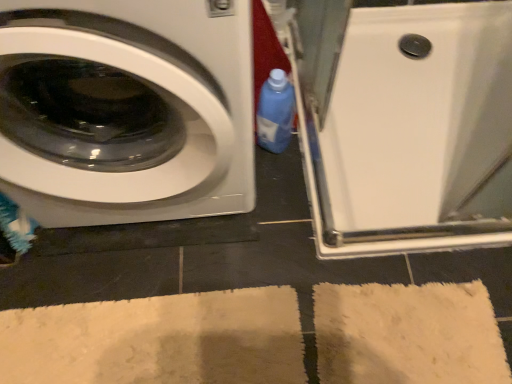
The height and width of the screenshot is (384, 512). Describe the element at coordinates (275, 112) in the screenshot. I see `blue plastic bottle at center` at that location.

Measure the distance between beige soft rug at lower center and camera.

beige soft rug at lower center and camera are 1.00 meters apart.

I want to click on blue plastic bottle at center, so click(x=275, y=112).

Considering the positions of points (234, 371) and (264, 105), is point (234, 371) farther from camera compared to point (264, 105)?

No, (234, 371) is in front of (264, 105).

From the image's perspective, which is above, beige soft rug at lower center or blue plastic bottle at center?

blue plastic bottle at center.

From the picture: Is beige soft rug at lower center looking in the opposite direction of blue plastic bottle at center?

No.

Which object is thinner, beige soft rug at lower center or blue plastic bottle at center?

blue plastic bottle at center.

Can you tell me how much blue plastic bottle at center and white glossy washing machine at left differ in facing direction?

blue plastic bottle at center and white glossy washing machine at left are facing 4.84 degrees away from each other.

Do you think blue plastic bottle at center is within white glossy washing machine at left, or outside of it?

blue plastic bottle at center is not inside white glossy washing machine at left, it's outside.

Is blue plastic bottle at center shorter than white glossy washing machine at left?

Yes.

Is white glossy washing machine at left not close to white glossy shower tray at upper right?

white glossy washing machine at left is near white glossy shower tray at upper right, not far away.

Which object is positioned more to the left, white glossy washing machine at left or white glossy shower tray at upper right?

white glossy washing machine at left is more to the left.

How much distance is there between white glossy washing machine at left and white glossy shower tray at upper right?

They are 23.84 inches apart.

Is white glossy shower tray at upper right wider than beige soft rug at lower center?

No.

Which is farther, (343,17) or (37,341)?

The point (343,17) is farther.

Where is `machine above the beige soft rug at lower center (from a real-world perspective)`? The width and height of the screenshot is (512, 384). machine above the beige soft rug at lower center (from a real-world perspective) is located at coordinates (403, 123).

Which of these two, white glossy shower tray at upper right or beige soft rug at lower center, stands taller?

white glossy shower tray at upper right.

Is blue plastic bottle at center oriented away from beige soft rug at lower center?

No, blue plastic bottle at center is not facing away from beige soft rug at lower center.

Is beige soft rug at lower center surrounded by blue plastic bottle at center?

Actually, beige soft rug at lower center is outside blue plastic bottle at center.

From a real-world perspective, which object stands above the other?

In real-world perspective, blue plastic bottle at center is above.

From the image's perspective, is beige soft rug at lower center located above or below white glossy shower tray at upper right?

beige soft rug at lower center is situated lower than white glossy shower tray at upper right in the image.

Who is smaller, beige soft rug at lower center or white glossy shower tray at upper right?

Smaller between the two is beige soft rug at lower center.

Based on the photo, is beige soft rug at lower center positioned far away from white glossy shower tray at upper right?

No, beige soft rug at lower center is not far away from white glossy shower tray at upper right.

Does point (126, 349) appear closer or farther from the camera than point (158, 32)?

Point (126, 349) is positioned farther from the camera compared to point (158, 32).

Is beige soft rug at lower center facing away from white glossy washing machine at left?

No, beige soft rug at lower center is not facing away from white glossy washing machine at left.

Which of these two, beige soft rug at lower center or white glossy washing machine at left, stands shorter?

beige soft rug at lower center.

From the image's perspective, relative to white glossy washing machine at left, is beige soft rug at lower center above or below?

beige soft rug at lower center is below white glossy washing machine at left.

The image size is (512, 384). I want to click on cleaning product above the beige soft rug at lower center (from a real-world perspective), so click(x=275, y=112).

I want to click on cleaning product located below the white glossy washing machine at left (from the image's perspective), so click(275, 112).

Estimate the real-world distances between objects in this image. Which object is closer to white glossy shower tray at upper right, beige soft rug at lower center or blue plastic bottle at center?

blue plastic bottle at center.

Which object lies further to the anchor point beige soft rug at lower center, white glossy washing machine at left or white glossy shower tray at upper right?

Among the two, white glossy shower tray at upper right is located further to beige soft rug at lower center.

Looking at the image, which one is located further to white glossy shower tray at upper right, beige soft rug at lower center or white glossy washing machine at left?

Among the two, beige soft rug at lower center is located further to white glossy shower tray at upper right.

Which object lies further to the anchor point beige soft rug at lower center, blue plastic bottle at center or white glossy washing machine at left?

blue plastic bottle at center is further to beige soft rug at lower center.

When comparing their distances from blue plastic bottle at center, does white glossy washing machine at left or white glossy shower tray at upper right seem closer?

Among the two, white glossy shower tray at upper right is located nearer to blue plastic bottle at center.

Looking at the image, which one is located further to blue plastic bottle at center, beige soft rug at lower center or white glossy shower tray at upper right?

beige soft rug at lower center.

Considering their positions, is blue plastic bottle at center positioned closer to white glossy shower tray at upper right than white glossy washing machine at left?

blue plastic bottle at center is positioned closer to the anchor white glossy shower tray at upper right.

Considering their positions, is blue plastic bottle at center positioned further to white glossy washing machine at left than white glossy shower tray at upper right?

white glossy shower tray at upper right is positioned further to the anchor white glossy washing machine at left.

Find the location of a particular element. This screenshot has width=512, height=384. bath mat between white glossy washing machine at left and white glossy shower tray at upper right in the horizontal direction is located at coordinates (158, 340).

At what (x,y) coordinates should I click in order to perform the action: click on cleaning product situated between white glossy washing machine at left and white glossy shower tray at upper right from left to right. Please return your answer as a coordinate pair (x, y). This screenshot has width=512, height=384. Looking at the image, I should click on (275, 112).

At what (x,y) coordinates should I click in order to perform the action: click on cleaning product between white glossy washing machine at left and beige soft rug at lower center in the up-down direction. Please return your answer as a coordinate pair (x, y). Looking at the image, I should click on (275, 112).

The height and width of the screenshot is (384, 512). Find the location of `cleaning product between white glossy shower tray at upper right and beige soft rug at lower center in the up-down direction`. cleaning product between white glossy shower tray at upper right and beige soft rug at lower center in the up-down direction is located at coordinates (275, 112).